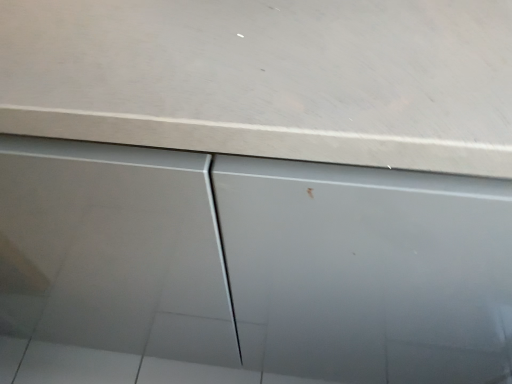
Find the location of a particular element. The width and height of the screenshot is (512, 384). matte gray cabinet at center is located at coordinates (249, 269).

Describe the element at coordinates (249, 269) in the screenshot. I see `matte gray cabinet at center` at that location.

Measure the distance between matte gray cabinet at center and camera.

They are 13.47 inches apart.

Locate an element on the screen. The width and height of the screenshot is (512, 384). matte gray cabinet at center is located at coordinates (249, 269).